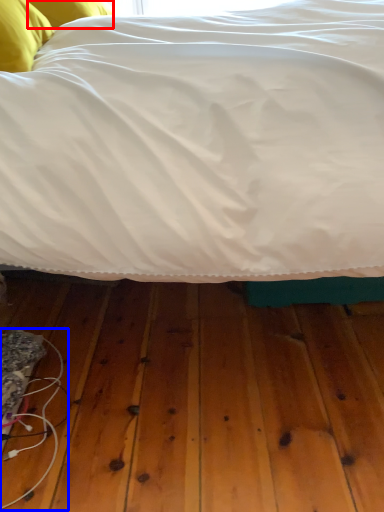
Question: Which object appears farthest to the camera in this image, pillow (highlighted by a red box) or wire (highlighted by a blue box)?

Choices:
 (A) pillow
 (B) wire

Answer: (A)